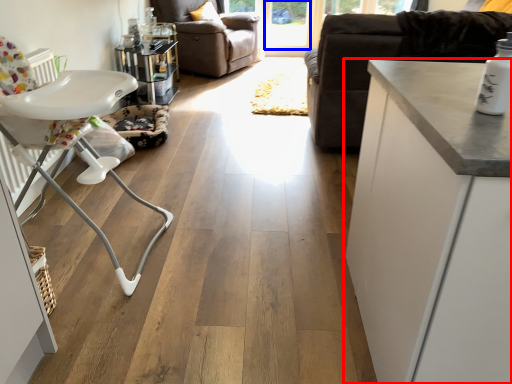
Question: Which object is closer to the camera taking this photo, cabinetry (highlighted by a red box) or window screen (highlighted by a blue box)?

Choices:
 (A) cabinetry
 (B) window screen

Answer: (A)